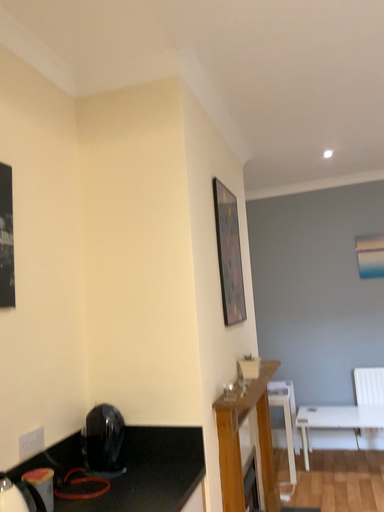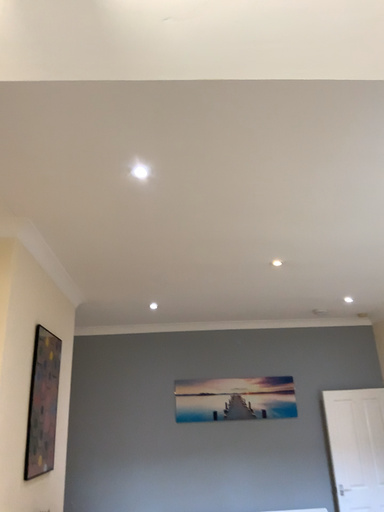
Question: Which way did the camera rotate in the video?

Choices:
 (A) rotated right
 (B) rotated left

Answer: (A)